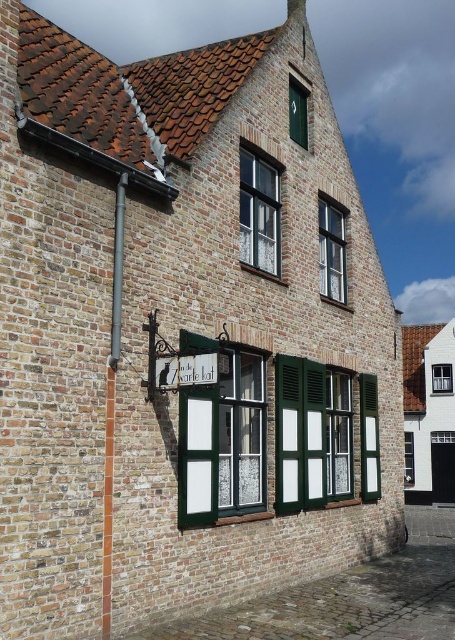
Based on the photo, you are an architect designing a new building inspired by this traditional style. You want to ensure that the green matte shutter at lower center and the green matte window at upper center maintain a proportional relationship. Based on the image, which one should be taller?

The green matte shutter at lower center is much taller than the green matte window at upper center, so the shutter should be designed to be taller than the window to maintain the traditional style.

You are an architect designing a new building inspired by this traditional style. You need to ensure that the green matte shutter at lower center and the green matte window at upper center are proportionally scaled. Based on the image, which of these two elements is larger in size?

The green matte shutter at lower center is larger in size compared to the green matte window at upper center.

You are standing in front of the traditional brick building and want to take a photo. You notice two points marked on the building. Which point, point (208, 460) or point (261, 218), is closer to your camera lens?

Point (208, 460) is closer to the camera than point (261, 218).